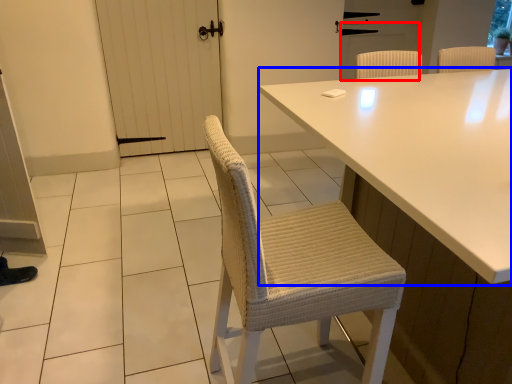
Question: Which object appears farthest to the camera in this image, screen door (highlighted by a red box) or table (highlighted by a blue box)?

Choices:
 (A) screen door
 (B) table

Answer: (A)